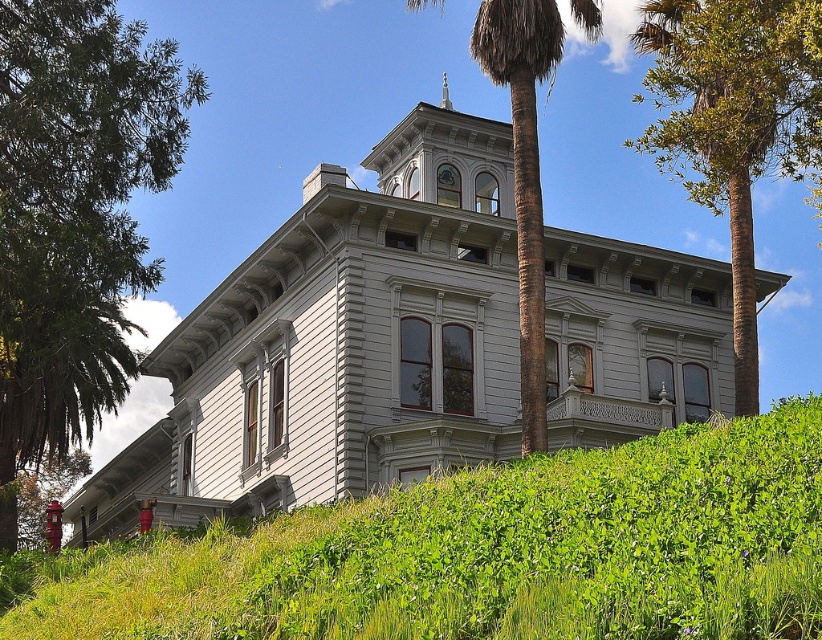
You are a landscape architect designing a garden path that needs to be exactly 10 meters long. You want to place the path between the green leafy palm at center and the brown textured palm tree at upper center. Is this possible?

The distance between the green leafy palm at center and the brown textured palm tree at upper center is 12.72 meters, which is longer than the required 10 meters. Therefore, the path cannot be placed between them while maintaining the exact 10 meters length.

You are standing at the base of the hill where the Victorian house is located. You notice a point marked at coordinates (486, 552). Based on the scene description, what is the object or feature located at this point?

The point at coordinates (486, 552) marks green leafy grass at lower center.

You are a landscape architect designing a garden for this Victorian house. You need to place a 3m wide decorative fountain between the green leafy grass at lower center and the silver metallic spire at upper center. Can the space between them accommodate the fountain?

The green leafy grass at lower center is wider than the silver metallic spire at upper center. However, the question is about the space between them accommodating a 3m wide fountain. Since the description only provides information about their individual widths, not the distance between them, it is impossible to determine if the space is sufficient based on the given information.